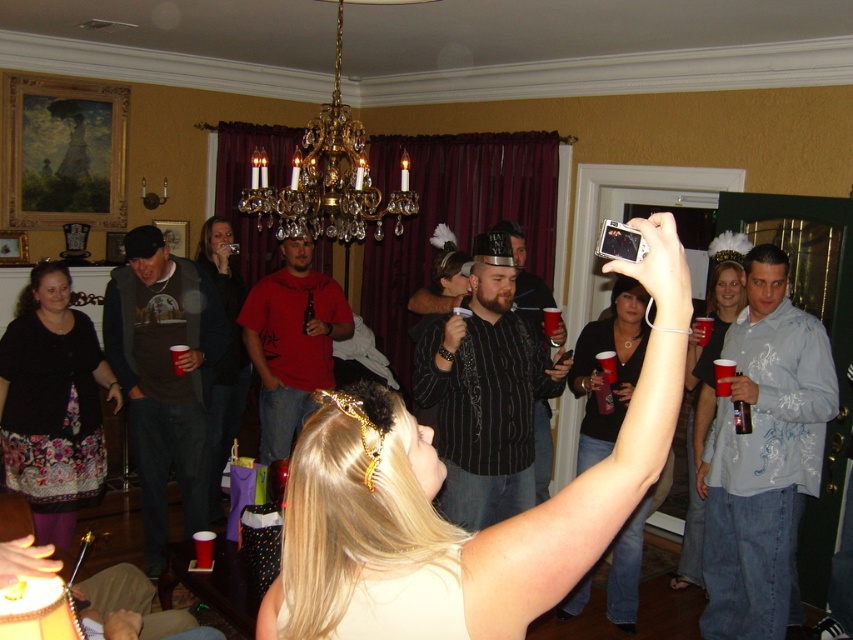
Question: Among these objects, which one is farthest from the camera?

Choices:
 (A) black matte dress at upper center
 (B) brown sweater at center
 (C) floral-patterned skirt at center
 (D) striped cotton shirt at center

Answer: (D)

Question: Can you confirm if brown sweater at center is positioned to the right of red cotton shirt at center?

Choices:
 (A) no
 (B) yes

Answer: (A)

Question: Does white textured shirt at center lie in front of black striped shirt at center?

Choices:
 (A) no
 (B) yes

Answer: (A)

Question: Which point is closer to the camera?

Choices:
 (A) red plastic cup at center
 (B) matte black camera at upper center
 (C) black matte dress at upper center

Answer: (B)

Question: Which point appears closest to the camera in this image?

Choices:
 (A) (782, 316)
 (B) (202, 291)
 (C) (547, 307)

Answer: (A)

Question: Is floral-patterned skirt at center thinner than matte black tiara at upper right?

Choices:
 (A) yes
 (B) no

Answer: (B)